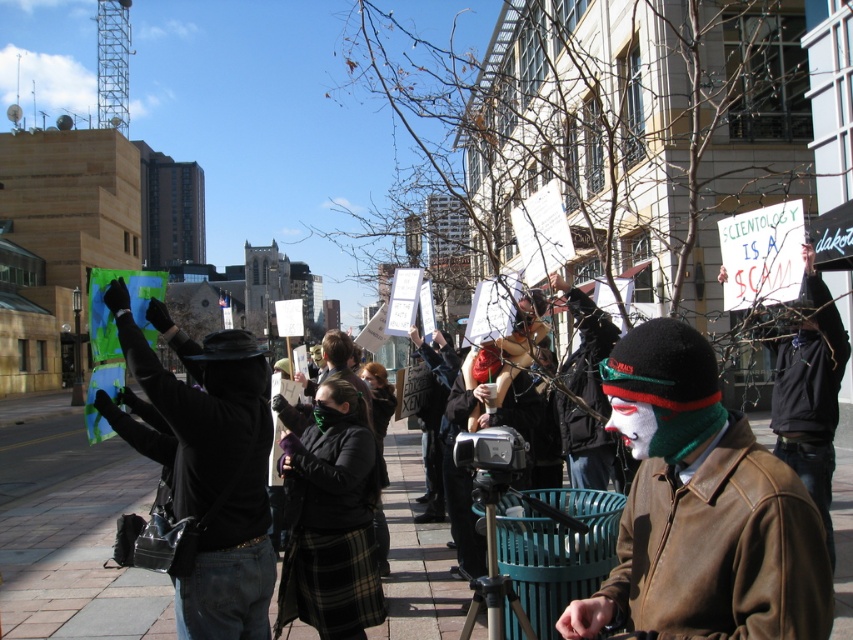
Between brown leather jacket at center and black leather jacket at center, which one appears on the right side from the viewer's perspective?

brown leather jacket at center

Is brown leather jacket at center to the right of black leather jacket at center from the viewer's perspective?

Indeed, brown leather jacket at center is positioned on the right side of black leather jacket at center.

Identify the location of brown leather jacket at center. The height and width of the screenshot is (640, 853). (701, 509).